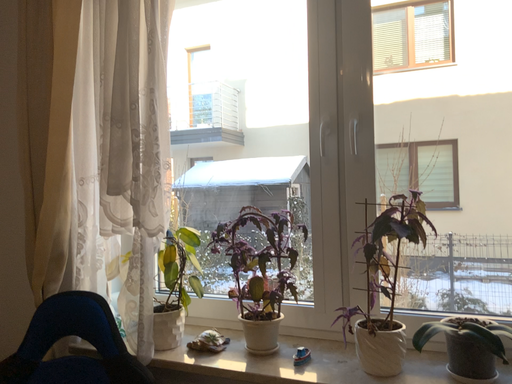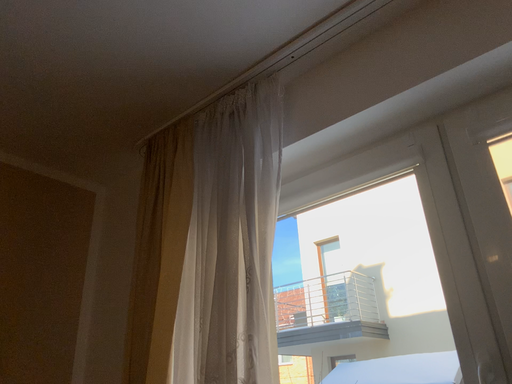
Question: How did the camera likely rotate when shooting the video?

Choices:
 (A) rotated downward
 (B) rotated upward

Answer: (B)